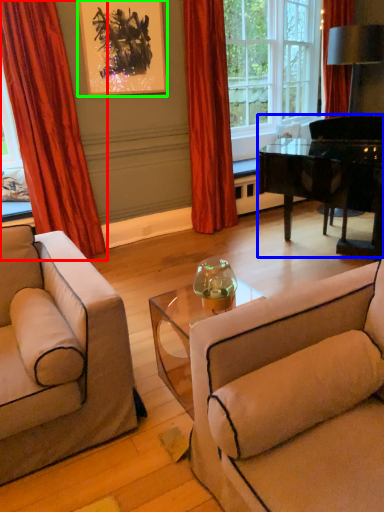
Question: Based on their relative distances, which object is farther from curtain (highlighted by a red box)? Choose from piano (highlighted by a blue box) and picture frame (highlighted by a green box).

Choices:
 (A) piano
 (B) picture frame

Answer: (A)